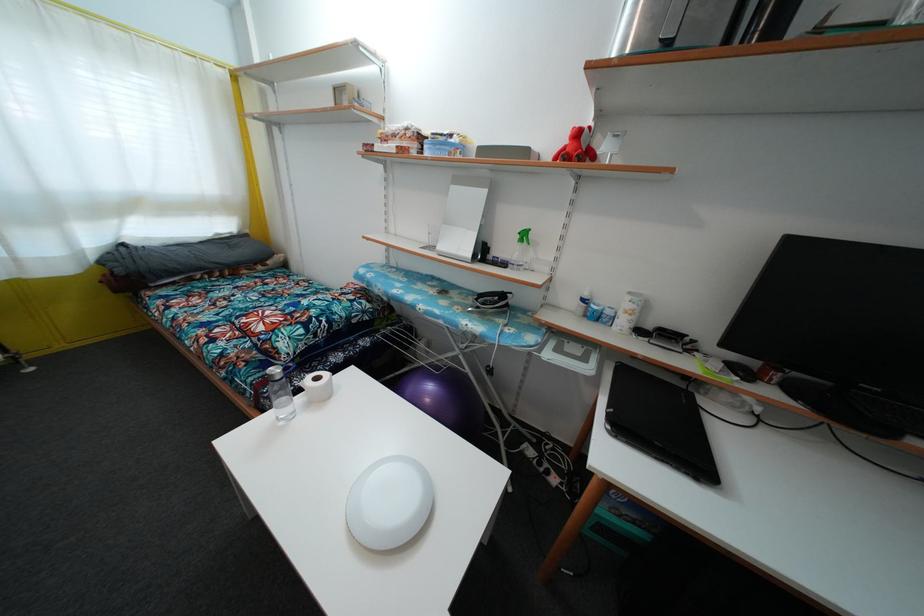
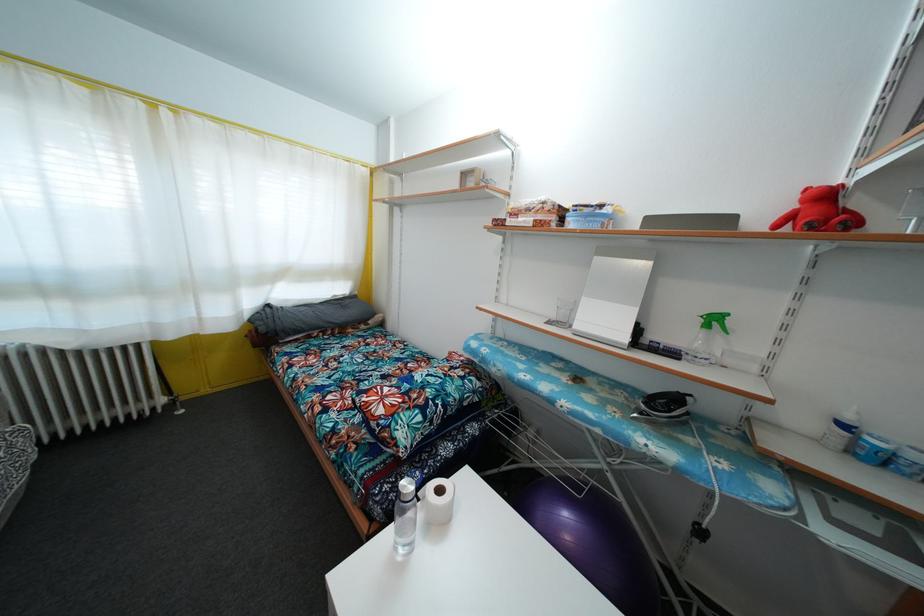
In the second image, find the point that corresponds to (x=455, y=142) in the first image.

(605, 213)